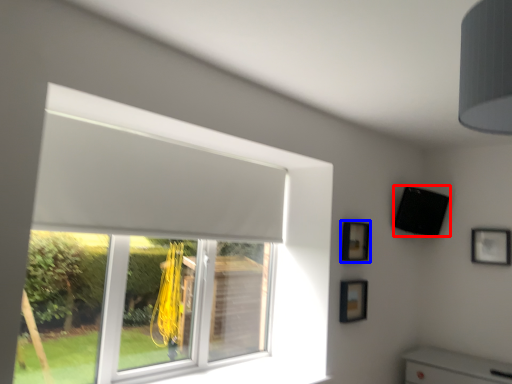
Question: Which object appears closest to the camera in this image, speaker (highlighted by a red box) or picture frame (highlighted by a blue box)?

Choices:
 (A) speaker
 (B) picture frame

Answer: (B)